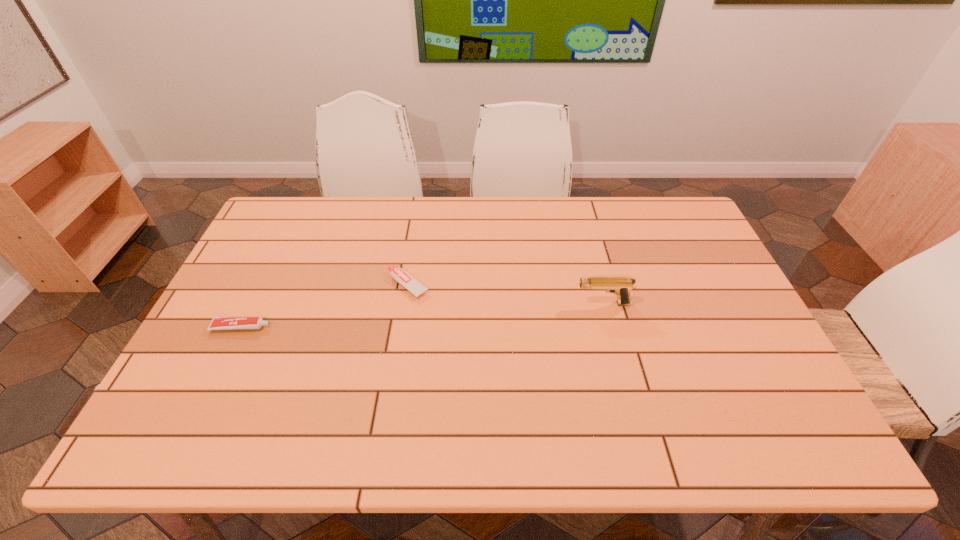
Find the location of a particular element. Image resolution: width=960 pixels, height=540 pixels. free space located at the nozzle of the nearer toothpaste is located at coordinates (326, 327).

Image resolution: width=960 pixels, height=540 pixels. I want to click on object that is at the left edge, so click(x=218, y=323).

The width and height of the screenshot is (960, 540). Find the location of `vacant space at the far edge of the desktop`. vacant space at the far edge of the desktop is located at coordinates (643, 220).

Where is `vacant space at the left edge of the desktop`? Image resolution: width=960 pixels, height=540 pixels. vacant space at the left edge of the desktop is located at coordinates (245, 285).

This screenshot has height=540, width=960. What are the coordinates of `vacant space at the right edge of the desktop` in the screenshot? It's located at (679, 268).

This screenshot has height=540, width=960. Identify the location of free space at the near left corner. (180, 427).

Locate an element on the screen. This screenshot has width=960, height=540. vacant area at the far right corner is located at coordinates (666, 201).

Locate an element on the screen. The height and width of the screenshot is (540, 960). vacant space at the near right corner of the desktop is located at coordinates (756, 444).

Locate an element on the screen. The width and height of the screenshot is (960, 540). unoccupied position between the pistol and the leftmost object is located at coordinates (422, 315).

At what (x,y) coordinates should I click in order to perform the action: click on vacant space that is in between the right toothpaste and the tallest object. Please return your answer as a coordinate pair (x, y). The height and width of the screenshot is (540, 960). Looking at the image, I should click on (505, 294).